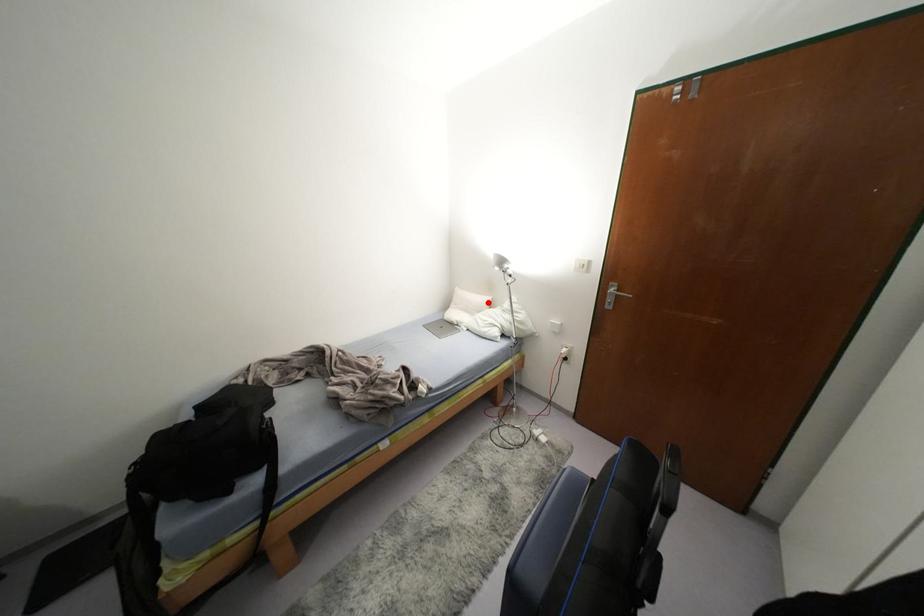
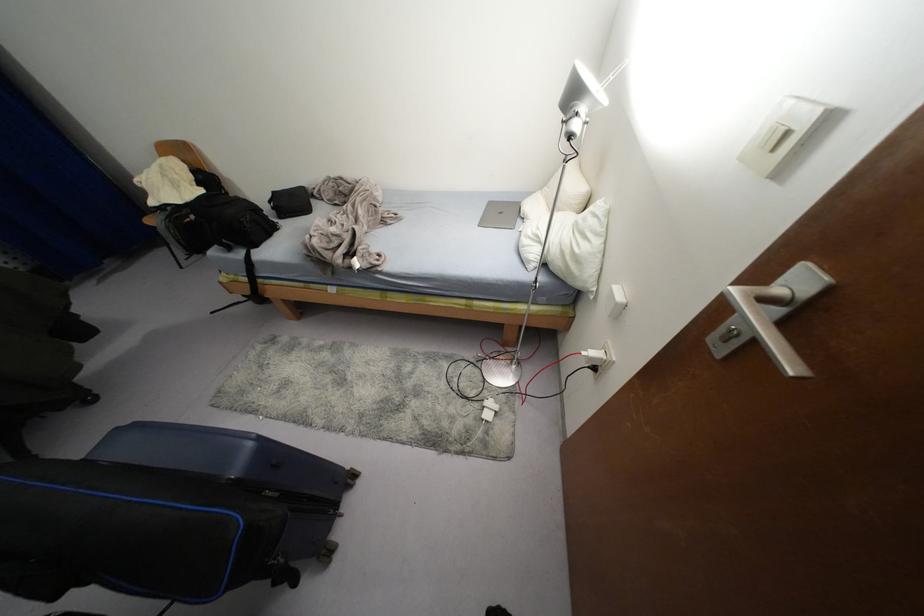
Question: I am providing you with two images of the same scene from different viewpoints. Given a red point in image1, look at the same physical point in image2. Is it:

Choices:
 (A) Closer to the viewpoint
 (B) Farther from the viewpoint

Answer: (A)